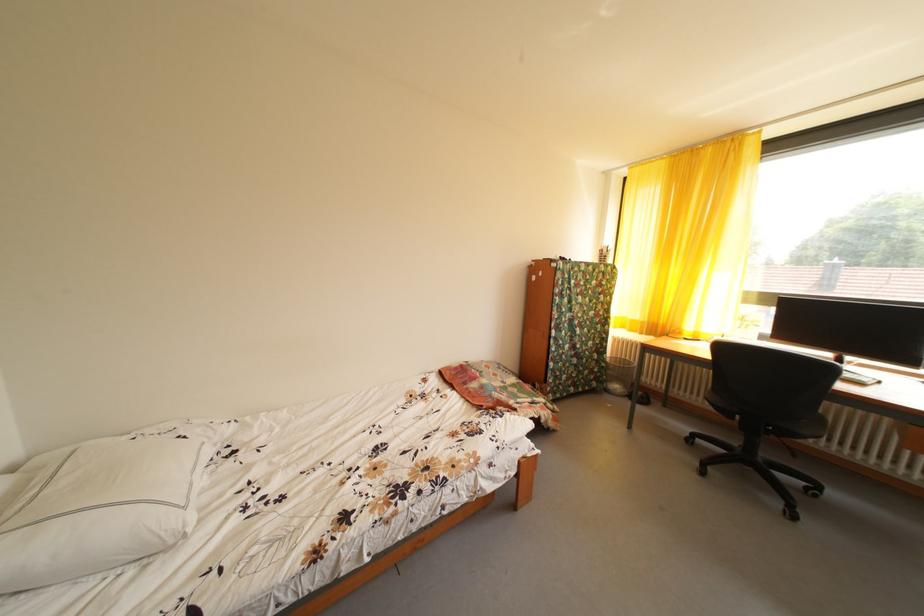
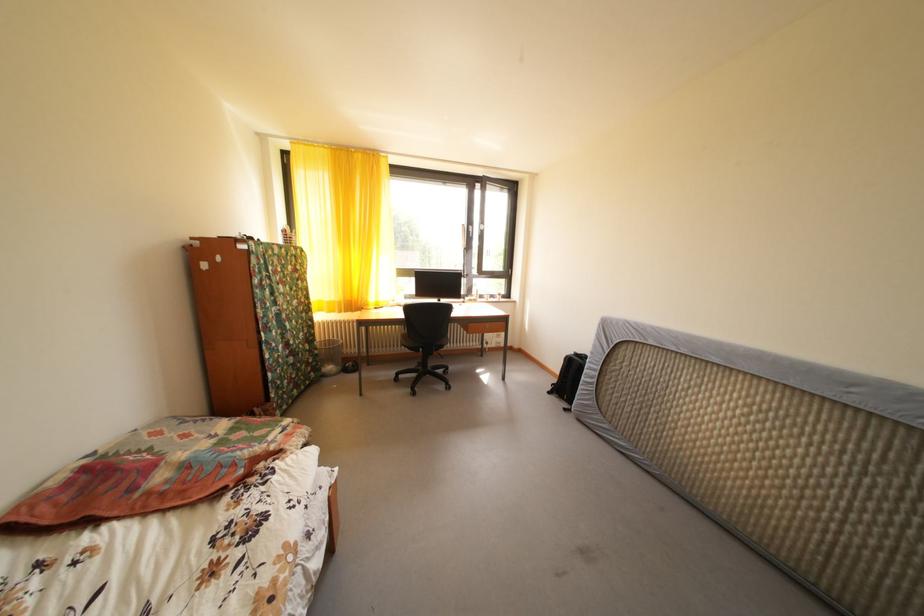
The point at (504, 381) is marked in the first image. Where is the corresponding point in the second image?

(195, 442)